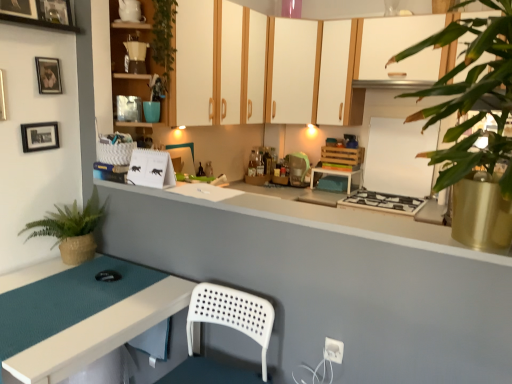
Question: Is wooden picture frame at upper left, the 3th picture frame when ordered from bottom to top, taller or shorter than white matte cabinet at upper center, the second cabinetry in the back-to-front sequence?

Choices:
 (A) short
 (B) tall

Answer: (A)

Question: In the image, is wooden picture frame at upper left, the 3th picture frame when ordered from bottom to top, positioned in front of or behind white matte cabinet at upper center, the second cabinetry in the back-to-front sequence?

Choices:
 (A) front
 (B) behind

Answer: (A)

Question: Which object is the closest to the matte black picture frame at upper left, which is the 2th picture frame from top to bottom?

Choices:
 (A) black matte picture frame at upper left, which appears as the 1th picture frame when ordered from the bottom
 (B) wooden table at center, which appears as the first table when viewed from the back
 (C) white matte cabinet at upper center, the third cabinetry from the left
 (D) white glossy exhaust hood at upper center
 (E) white glossy stove at center, which is the first appliance in back-to-front order

Answer: (A)

Question: Estimate the real-world distances between objects in this image. Which object is closer to the teal glass jar at upper center?

Choices:
 (A) matte black picture frame at upper left, which is the 2th picture frame from top to bottom
 (B) matte yellow coffee maker at upper center
 (C) matte wood cabinet at upper left, marked as the third cabinetry in a back-to-front arrangement
 (D) wooden table at center, the 1th table viewed from the right
 (E) white matte cabinet at upper center, marked as the 1th cabinetry in a back-to-front arrangement

Answer: (B)